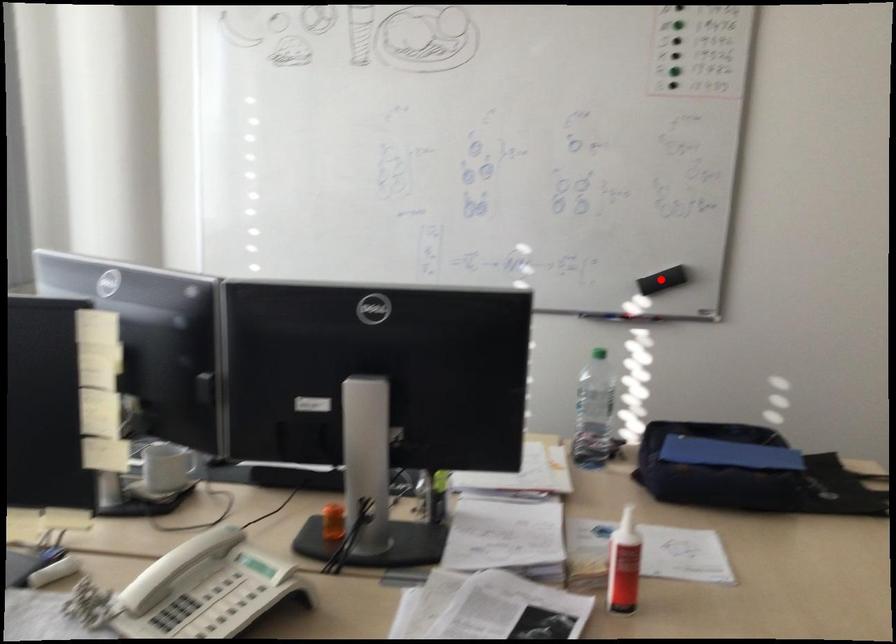
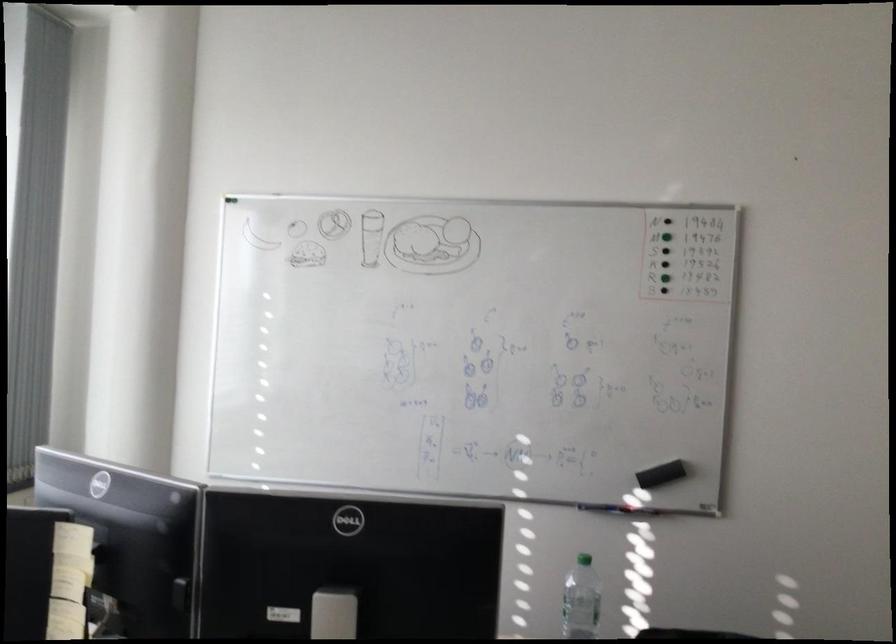
Locate, in the second image, the point that corresponds to the highlighted location in the first image.

(661, 474)